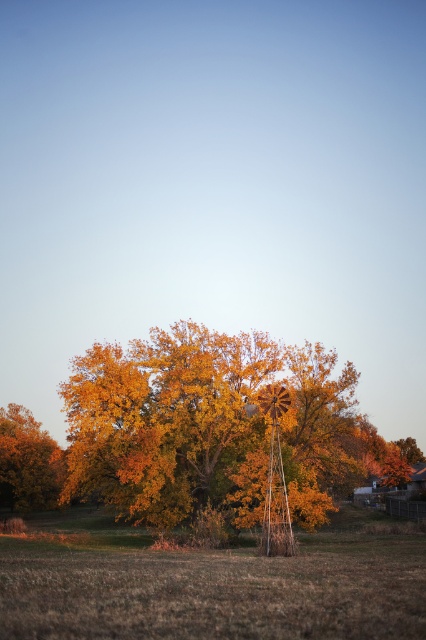
You are a landscape photographer planning to capture the golden textured tree at lower left and the brown grass at center in your shot. Which object will occupy more space in the final photograph?

The brown grass at center will occupy more space in the final photograph because it is bigger than the golden textured tree at lower left according to the description.